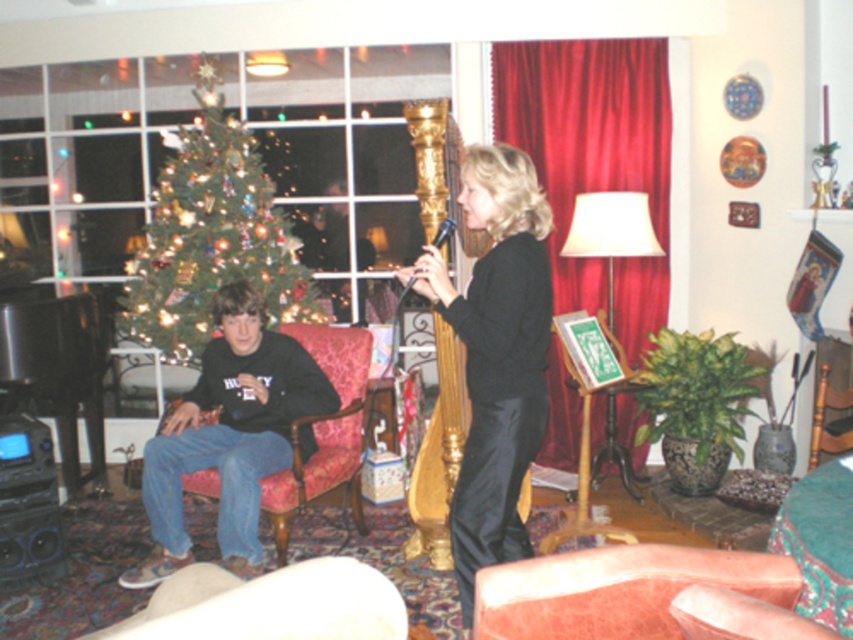
Question: Among these objects, which one is nearest to the camera?

Choices:
 (A) wooden armchair at lower right
 (B) velvet pink armchair at lower center

Answer: (B)

Question: Which is nearer to the wooden armchair at lower right?

Choices:
 (A) matte black hautboy at left
 (B) green matte christmas tree at left

Answer: (A)

Question: Considering the real-world distances, which object is closest to the matte black hautboy at left?

Choices:
 (A) green matte christmas tree at left
 (B) wooden armchair at lower right
 (C) velvet pink armchair at lower center
 (D) black satin dress at center

Answer: (A)

Question: Does velvet pink armchair at lower center have a larger size compared to wooden armchair at lower right?

Choices:
 (A) yes
 (B) no

Answer: (B)

Question: Is black satin dress at center wider than matte black hautboy at left?

Choices:
 (A) yes
 (B) no

Answer: (B)

Question: Is green matte christmas tree at left to the right of wooden armchair at lower right from the viewer's perspective?

Choices:
 (A) no
 (B) yes

Answer: (A)